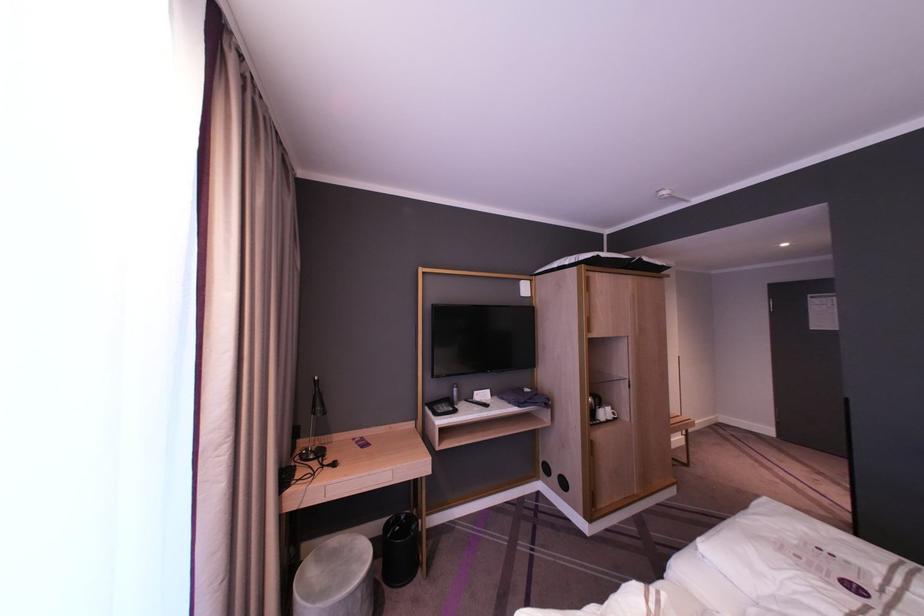
The location [335,578] corresponds to which object?

This point indicates the gray stool.